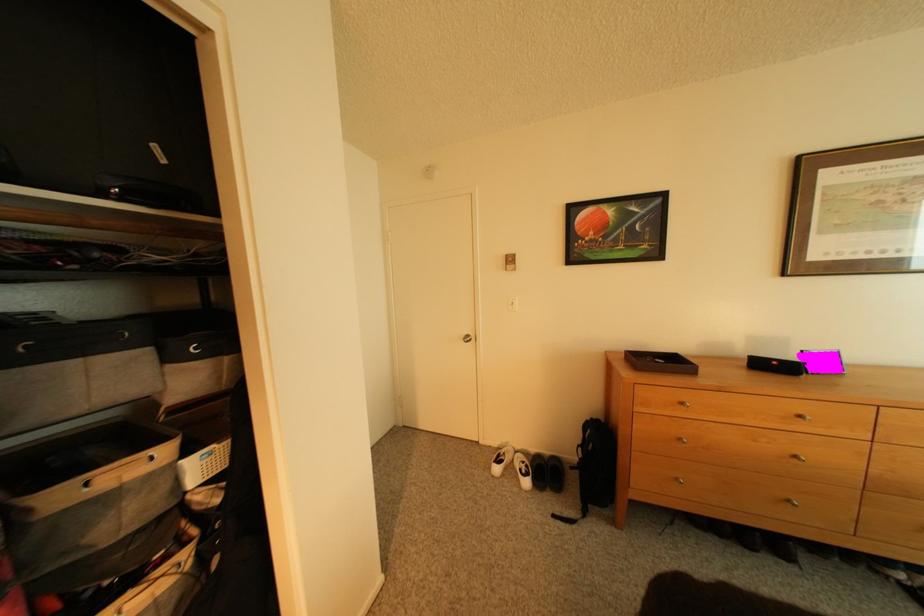
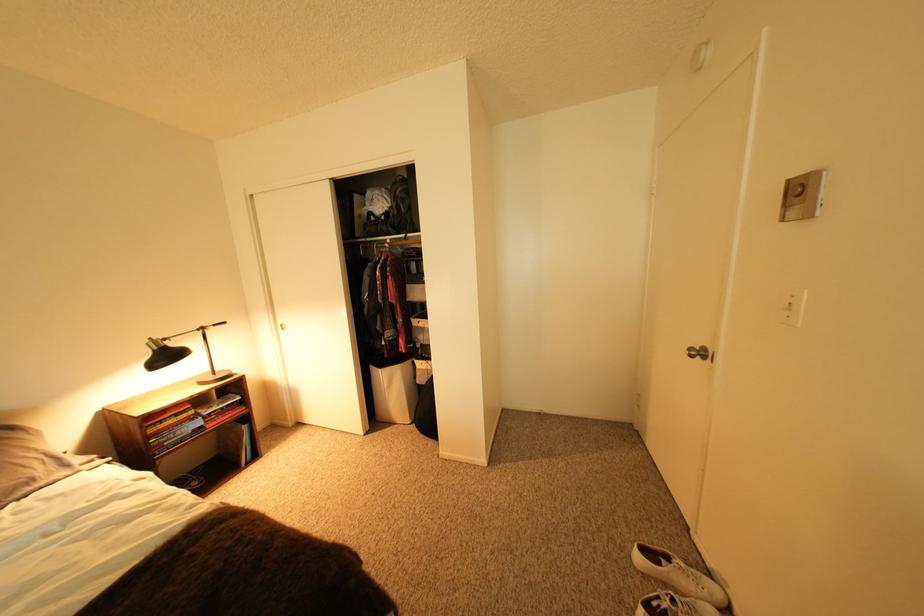
In the second image, find the point that corresponds to (478,339) in the first image.

(703, 351)